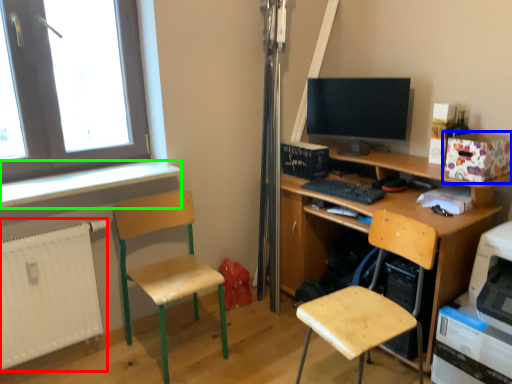
Question: Estimate the real-world distances between objects in this image. Which object is closer to radiator (highlighted by a red box), box (highlighted by a blue box) or window sill (highlighted by a green box)?

Choices:
 (A) box
 (B) window sill

Answer: (B)